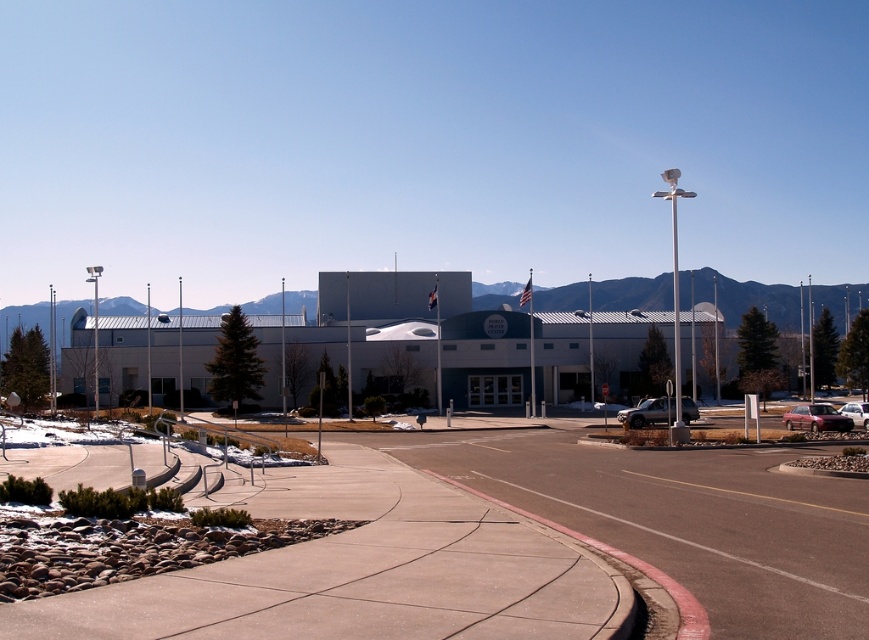
You are standing in front of the large modern building and want to determine the relative positions of two points marked on the ground. The first point is at coordinates point (247,561) and the second is at point (867,417). Which point is closer to you?

Point (247,561) is closer to the viewer than point (867,417).

You are a visitor arriving at the World Poker Center and need to park your car. You see two cars, a satin burgundy sedan at lower right and a satin silver sedan at lower right. Which car is closer to the parking lot entrance?

The satin silver sedan at lower right is closer to the parking lot entrance because the satin burgundy sedan at lower right is positioned on the right side of it, implying the silver one is nearer to the entrance.